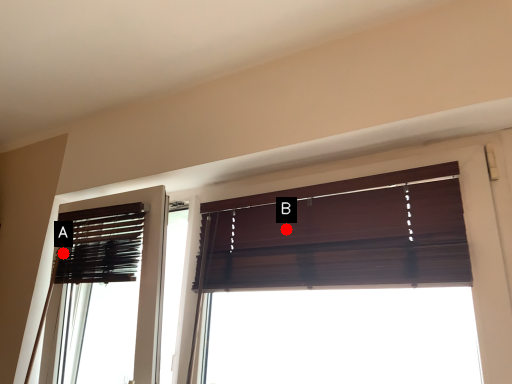
Question: Two points are circled on the image, labeled by A and B beside each circle. Which point is farther to the camera?

Choices:
 (A) A is further
 (B) B is further

Answer: (A)